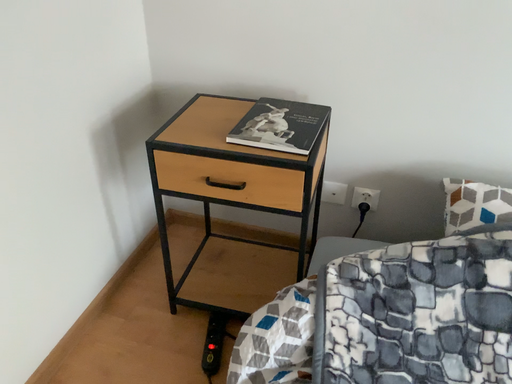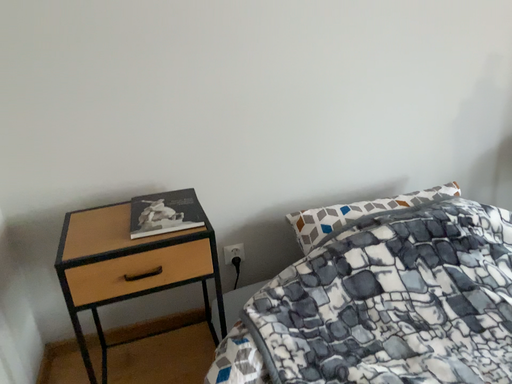
Question: Which way did the camera rotate in the video?

Choices:
 (A) rotated downward
 (B) rotated upward

Answer: (B)